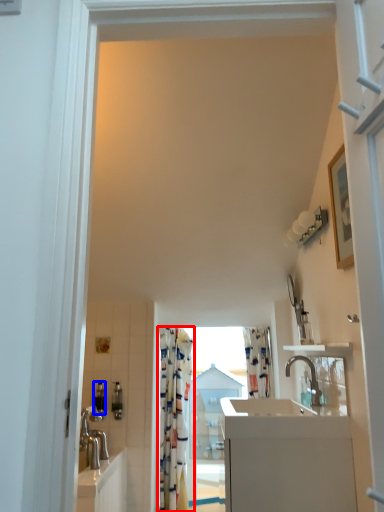
Question: Which object is further to the camera taking this photo, curtain (highlighted by a red box) or toiletry (highlighted by a blue box)?

Choices:
 (A) curtain
 (B) toiletry

Answer: (A)